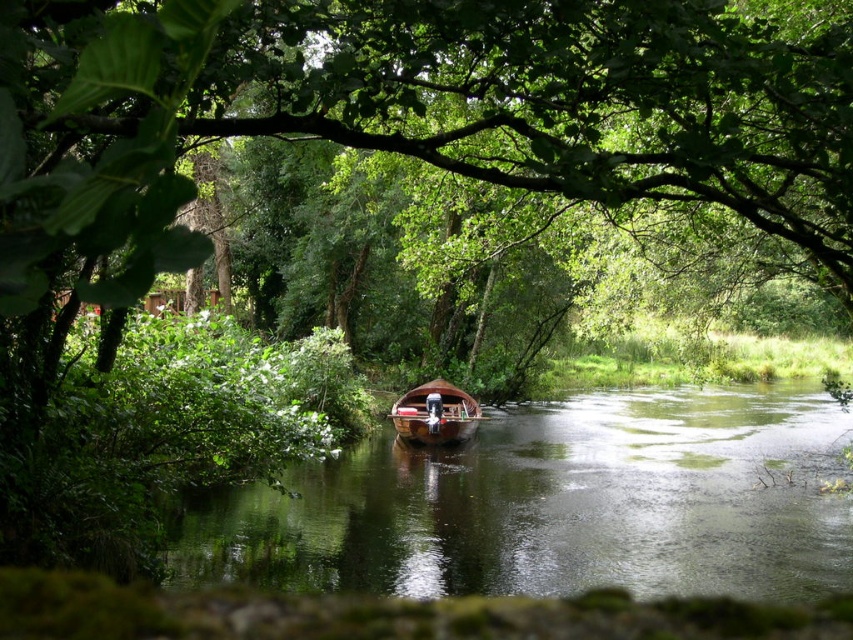
You are standing at the riverbank and want to reach a specific point in the river marked as point (805, 488). If your maximum comfortable walking distance in water is 20 meters, can you safely reach that point?

The distance of point (805, 488) from camera is 18.80 meters, so yes, you can safely reach that point as it is within your maximum comfortable walking distance of 20 meters.